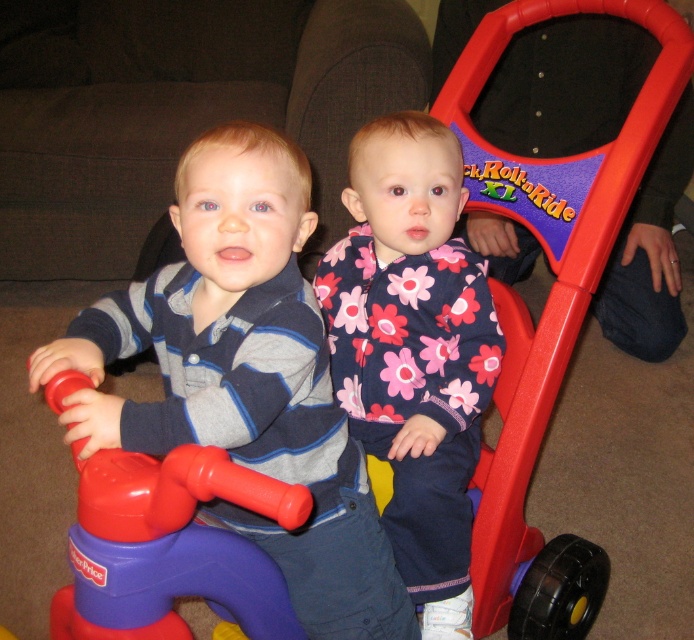
Question: Is matte plastic boy at center to the left of rubberized plastic toy at center from the viewer's perspective?

Choices:
 (A) no
 (B) yes

Answer: (A)

Question: Which of the following is the closest to the observer?

Choices:
 (A) (276, 157)
 (B) (414, 284)

Answer: (A)

Question: Can you confirm if matte plastic boy at center is smaller than floral fabric jacket at center?

Choices:
 (A) no
 (B) yes

Answer: (A)

Question: Is the position of matte plastic boy at center more distant than that of floral fabric jacket at center?

Choices:
 (A) yes
 (B) no

Answer: (B)

Question: Which point is farther to the camera?

Choices:
 (A) (53, 356)
 (B) (423, 145)
 (C) (176, 586)

Answer: (B)

Question: Among these points, which one is farthest from the camera?

Choices:
 (A) (439, 518)
 (B) (244, 381)

Answer: (A)